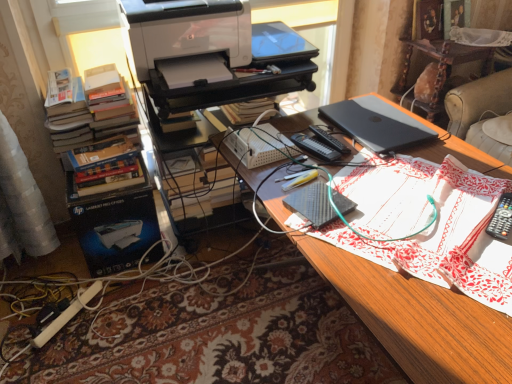
I want to click on vacant location below black matte laptop at upper right (from a real-world perspective), so click(x=386, y=127).